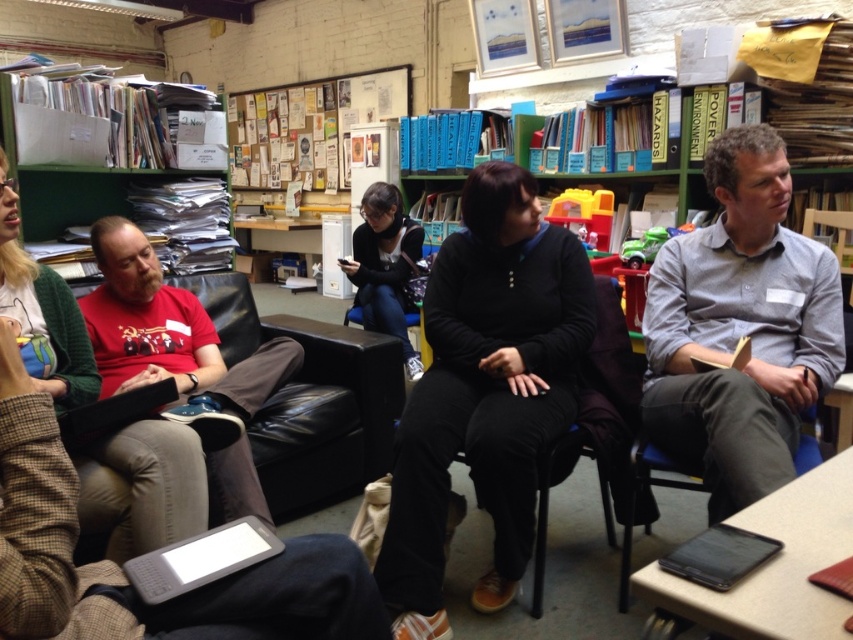
Question: Is the position of black matte sweater at center less distant than that of red t-shirt at left?

Choices:
 (A) no
 (B) yes

Answer: (A)

Question: Which object is positioned closest to the red t-shirt at left?

Choices:
 (A) gray cotton shirt at center
 (B) black leather armchair at center

Answer: (B)

Question: Estimate the real-world distances between objects in this image. Which object is closer to the red t-shirt at left?

Choices:
 (A) black matte sweater at center
 (B) black fabric jacket at center

Answer: (A)

Question: Does black matte sweater at center have a smaller size compared to black leather armchair at center?

Choices:
 (A) yes
 (B) no

Answer: (A)

Question: Among these objects, which one is nearest to the camera?

Choices:
 (A) black leather armchair at center
 (B) gray cotton shirt at center
 (C) black fabric jacket at center
 (D) red t-shirt at left

Answer: (B)

Question: Observing the image, what is the correct spatial positioning of black leather armchair at center in reference to black fabric jacket at center?

Choices:
 (A) above
 (B) below

Answer: (B)